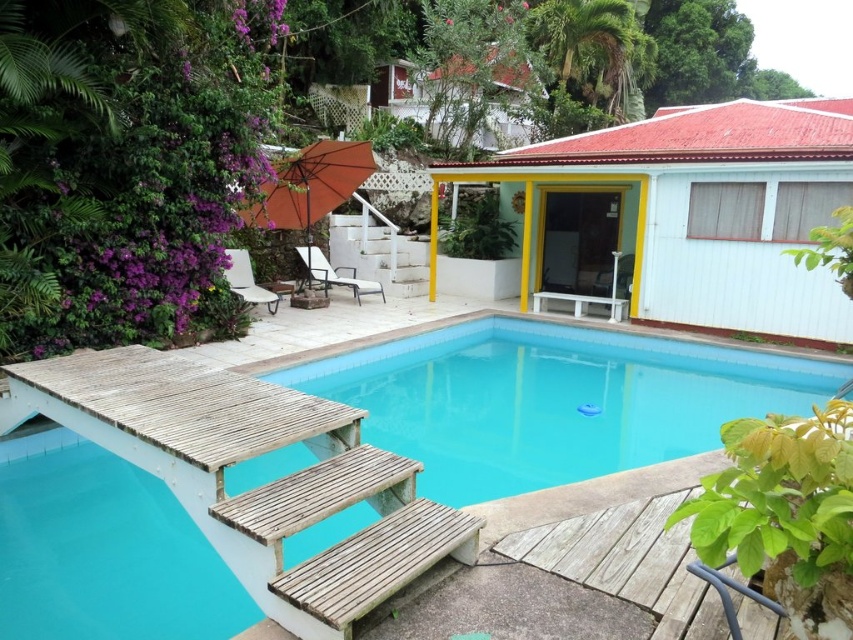
Identify the location of white fabric chaise lounge at center. (335, 273).

Which is more to the left, white fabric chaise lounge at center or white plastic chair at upper left?

Positioned to the left is white plastic chair at upper left.

Who is more distant from viewer, (341, 276) or (241, 298)?

The point (341, 276) is behind.

Locate an element on the screen. white fabric chaise lounge at center is located at coordinates (335, 273).

Between orange fabric umbrella at upper center and white plastic chair at upper left, which one appears on the left side from the viewer's perspective?

From the viewer's perspective, white plastic chair at upper left appears more on the left side.

Can you confirm if orange fabric umbrella at upper center is bigger than white plastic chair at upper left?

Yes, orange fabric umbrella at upper center is bigger than white plastic chair at upper left.

Identify the location of orange fabric umbrella at upper center. (310, 186).

Measure the distance between point (271,294) and camera.

Point (271,294) and camera are 28.89 feet apart from each other.

Does point (270, 294) lie behind point (630, 276)?

No, (270, 294) is closer to viewer.

Identify the location of white plastic chair at upper left. point(247,280).